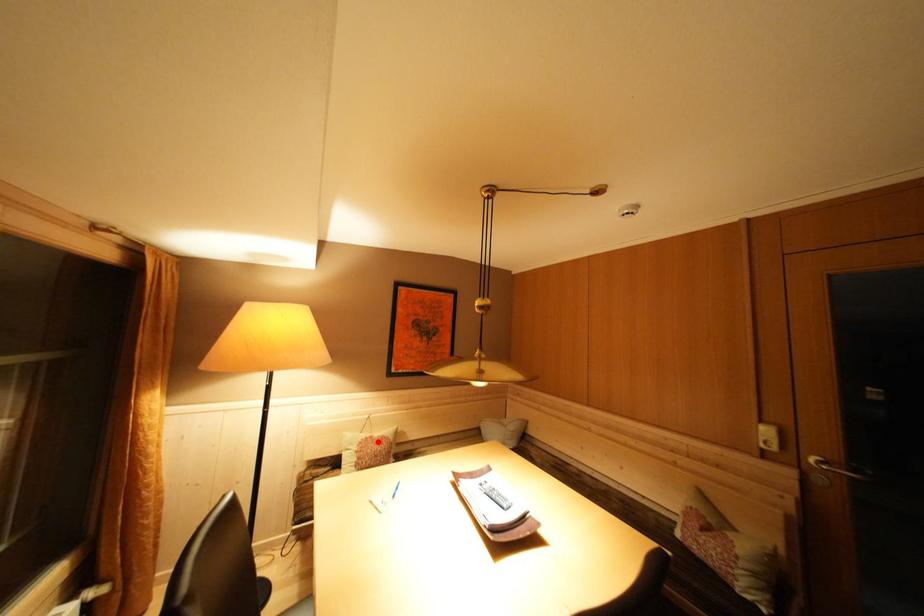
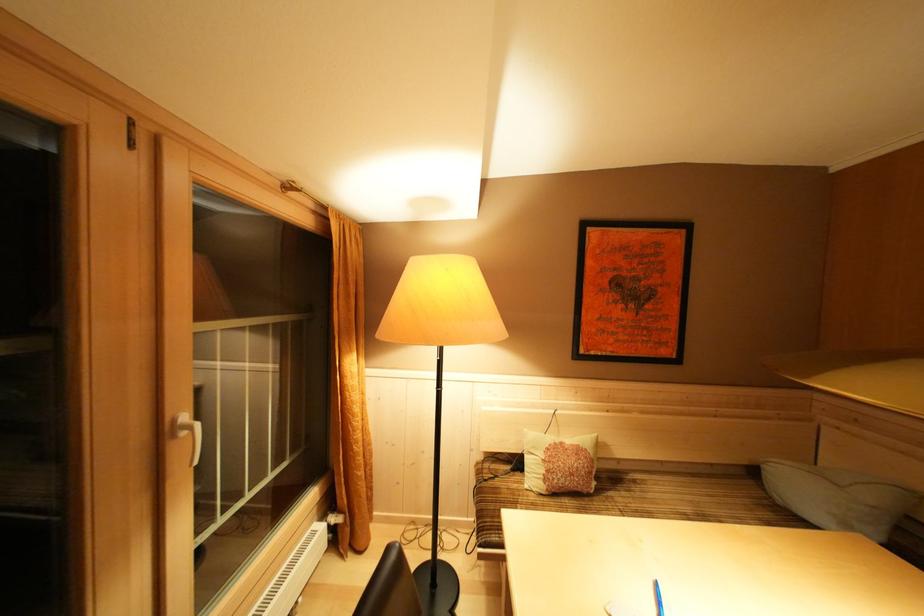
Locate, in the second image, the point that corresponds to the highlighted location in the first image.

(568, 448)